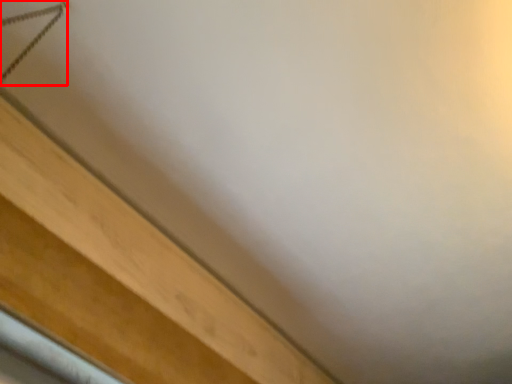
Question: Considering the relative positions of twin (annotated by the red box) and furniture in the image provided, where is twin (annotated by the red box) located with respect to the staircase?

Choices:
 (A) left
 (B) right

Answer: (A)